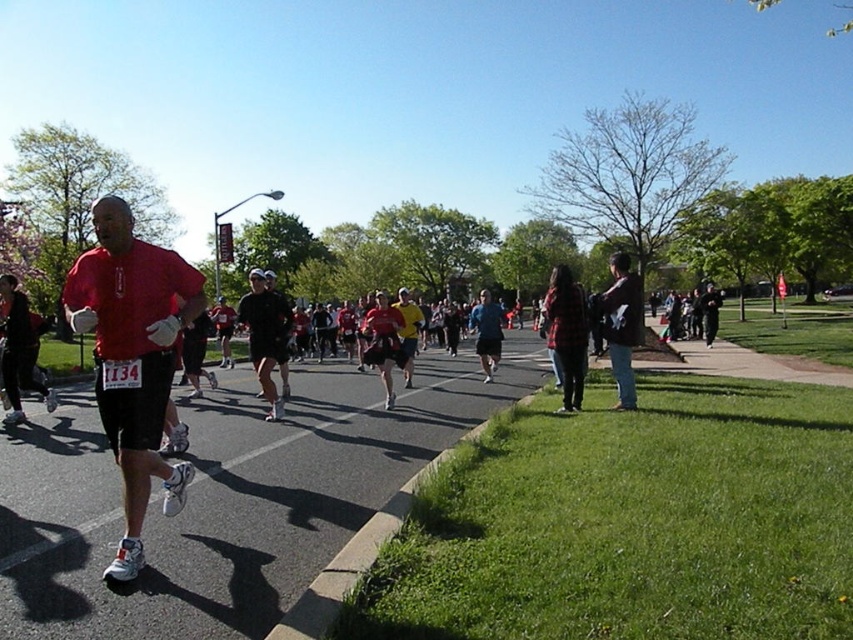
Does matte red shirt at left have a lesser height compared to brown leather jacket at right?

Indeed, matte red shirt at left has a lesser height compared to brown leather jacket at right.

Does matte red shirt at left appear over brown leather jacket at right?

Incorrect, matte red shirt at left is not positioned above brown leather jacket at right.

The width and height of the screenshot is (853, 640). Identify the location of matte red shirt at left. (132, 358).

Locate an element on the screen. matte red shirt at left is located at coordinates (132, 358).

Can you confirm if black matte shorts at center is bigger than yellow fabric shirt at center?

Yes.

Is point (267, 308) closer to viewer compared to point (401, 298)?

Yes.

Identify the location of black matte shorts at center. (265, 336).

This screenshot has width=853, height=640. What are the coordinates of `matte red shirt at left` in the screenshot? It's located at (132, 358).

Is matte red shirt at left bigger than yellow fabric shirt at center?

Actually, matte red shirt at left might be smaller than yellow fabric shirt at center.

Is point (160, 390) less distant than point (405, 312)?

Yes.

You are a GUI agent. You are given a task and a screenshot of the screen. Output one action in this format:
    pyautogui.click(x=<x>, y=<y>)
    Task: Click on the matte red shirt at left
    
    Given the screenshot: What is the action you would take?
    pyautogui.click(x=132, y=358)